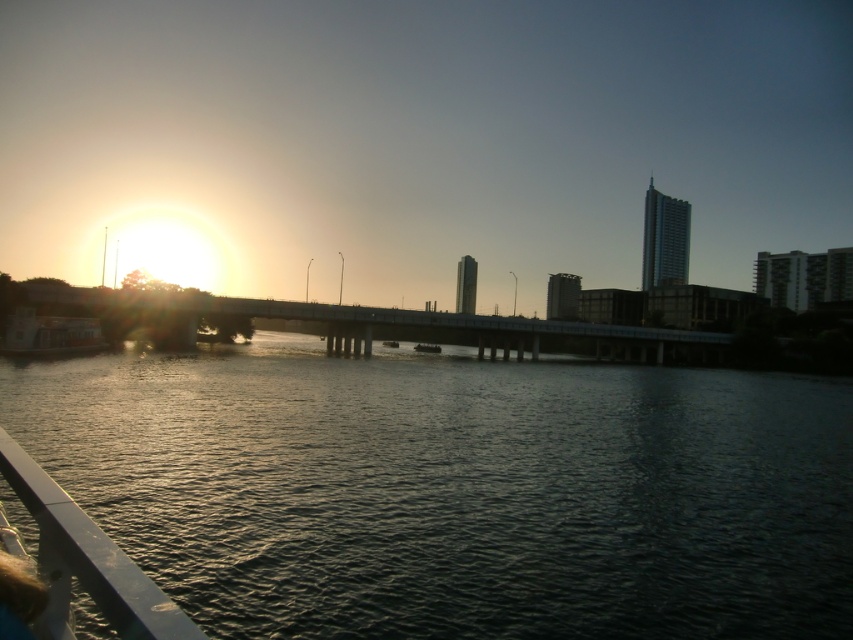
Question: In this image, where is dark water at center located relative to concrete bridge at center?

Choices:
 (A) above
 (B) below

Answer: (B)

Question: Which is farther from the concrete bridge at center?

Choices:
 (A) metallic gray boat at center
 (B) metallic silver boat at lower left
 (C) metallic silver rail at lower left
 (D) dark water at center

Answer: (C)

Question: Among these points, which one is farthest from the camera?

Choices:
 (A) (15, 320)
 (B) (416, 348)

Answer: (B)

Question: Is dark water at center smaller than metallic gray boat at center?

Choices:
 (A) no
 (B) yes

Answer: (A)

Question: Which of the following is the farthest from the observer?

Choices:
 (A) (73, 387)
 (B) (434, 349)
 (C) (44, 564)

Answer: (B)

Question: Observing the image, what is the correct spatial positioning of dark water at center in reference to concrete bridge at center?

Choices:
 (A) left
 (B) right

Answer: (B)